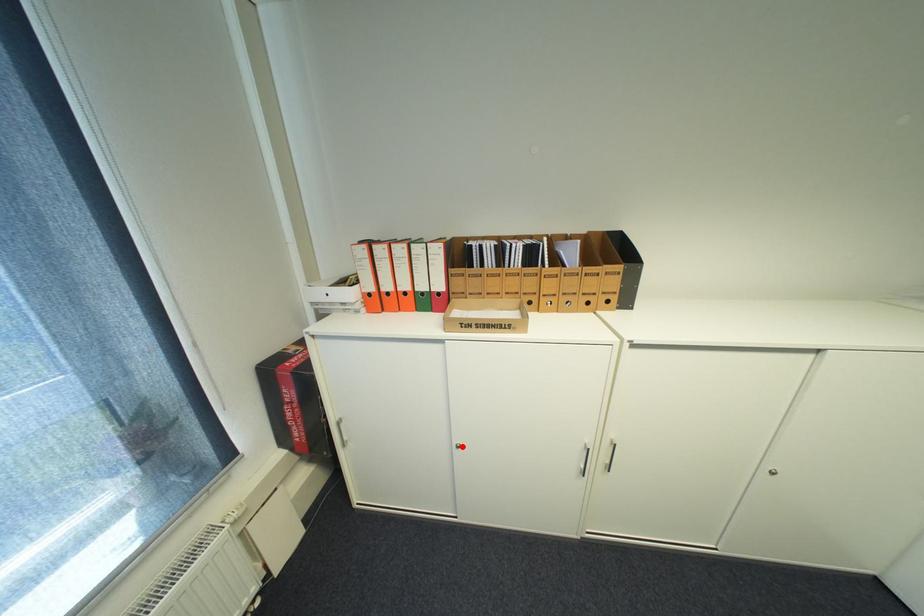
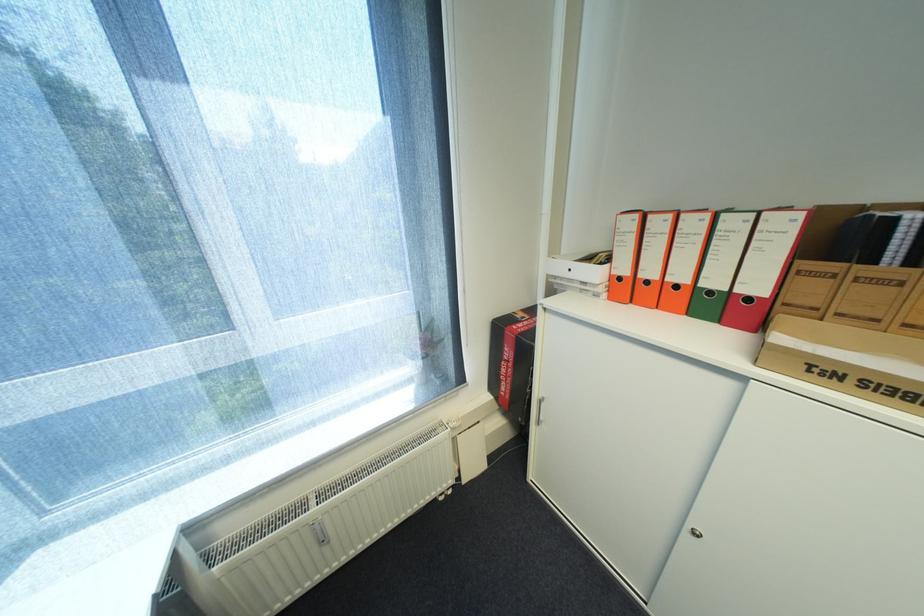
In the second image, find the point that corresponds to the highlighted location in the first image.

(697, 528)